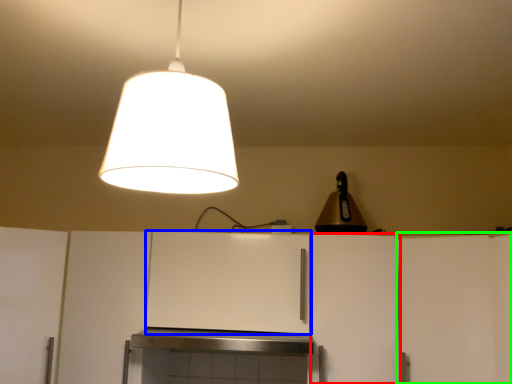
Question: Based on their relative distances, which object is farther from cabinetry (highlighted by a red box)? Choose from cabinetry (highlighted by a blue box) and cabinetry (highlighted by a green box).

Choices:
 (A) cabinetry
 (B) cabinetry

Answer: (A)